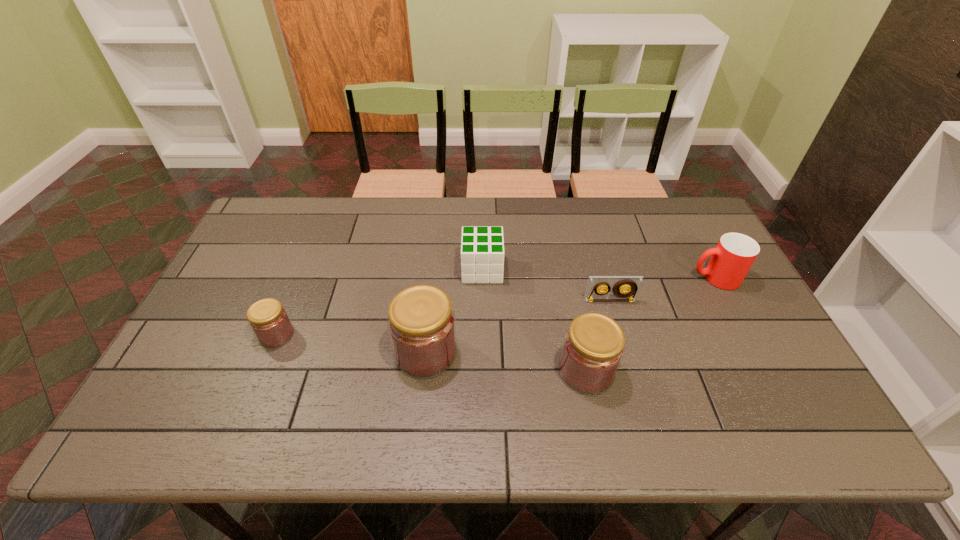
At what (x,y) coordinates should I click in order to perform the action: click on vacant space at the right edge of the desktop. Please return your answer as a coordinate pair (x, y). Image resolution: width=960 pixels, height=540 pixels. Looking at the image, I should click on (734, 337).

Identify the location of free space at the far right corner. This screenshot has height=540, width=960. (677, 228).

Where is `vacant region between the cube and the rightmost jam`? vacant region between the cube and the rightmost jam is located at coordinates (535, 320).

You are a GUI agent. You are given a task and a screenshot of the screen. Output one action in this format:
    pyautogui.click(x=<x>, y=<y>)
    Task: Click on the vacant space that is in between the leftmost jam and the rightmost object
    
    Given the screenshot: What is the action you would take?
    pyautogui.click(x=495, y=306)

Where is `vacant area that lies between the cube and the fifth object from right to left`? vacant area that lies between the cube and the fifth object from right to left is located at coordinates (454, 311).

Where is `vacant area that lies between the fifth object from right to left and the videotape`? This screenshot has height=540, width=960. vacant area that lies between the fifth object from right to left and the videotape is located at coordinates (517, 327).

Find the location of `vacant space that's between the cup and the videotape`. vacant space that's between the cup and the videotape is located at coordinates (662, 289).

At what (x,y) coordinates should I click in order to perform the action: click on object that can be found as the third closest to the videotape. Please return your answer as a coordinate pair (x, y). Looking at the image, I should click on (484, 254).

Identify which object is the fourth nearest to the fourth nearest object. Please provide its 2D coordinates. Your answer should be formatted as a tuple, i.e. [(x, y)], where the tuple contains the x and y coordinates of a point satisfying the conditions above.

[(421, 323)]

Locate which jam ranks in proximity to the fourth object from right to left. Please provide its 2D coordinates. Your answer should be formatted as a tuple, i.e. [(x, y)], where the tuple contains the x and y coordinates of a point satisfying the conditions above.

[(421, 323)]